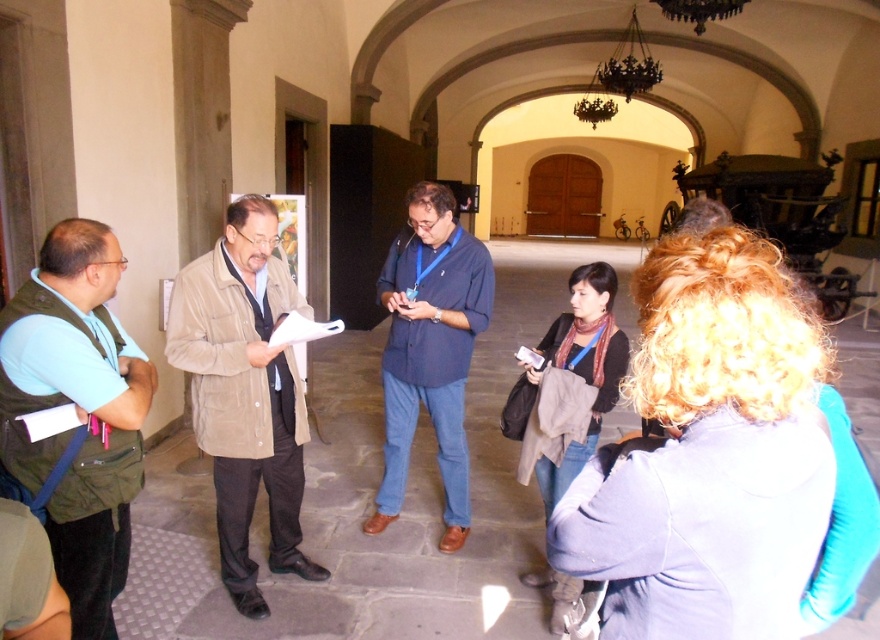
You are standing at the entrance of the building and want to find the suede jacket at center. According to the coordinates, which direction should you move to locate it?

The suede jacket at center is located at coordinates point (x=246, y=392). Since the x coordinate is greater than 0.5, you should move to the right from the entrance to locate it.

You are standing in the museum and want to take a photo of both the green fabric vest at left and the blue shirt at center. Which direction should you move to frame both in your camera?

To frame both the green fabric vest at left and the blue shirt at center in your camera, you should move to the left so that both are visible in the frame since the green fabric vest at left is positioned to the left of the blue shirt at center.